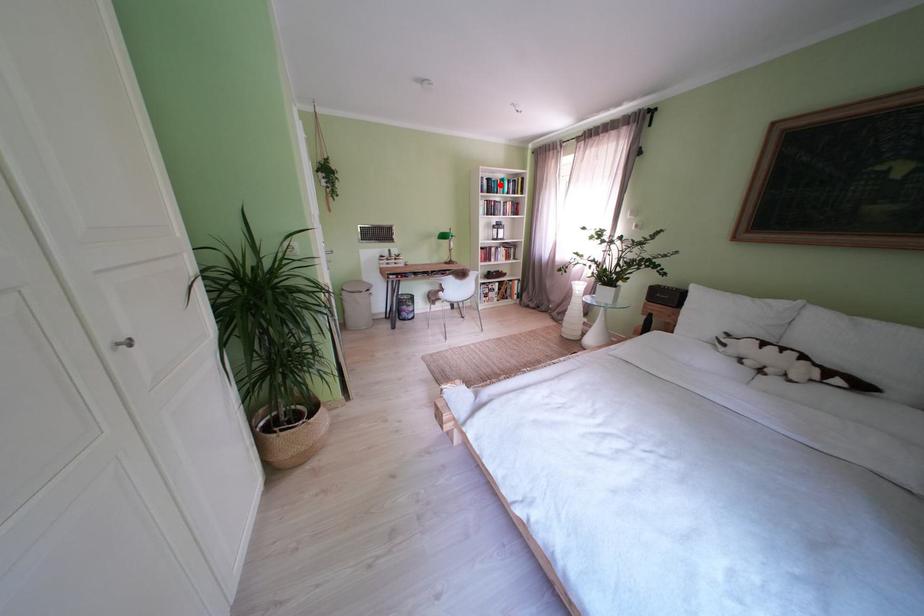
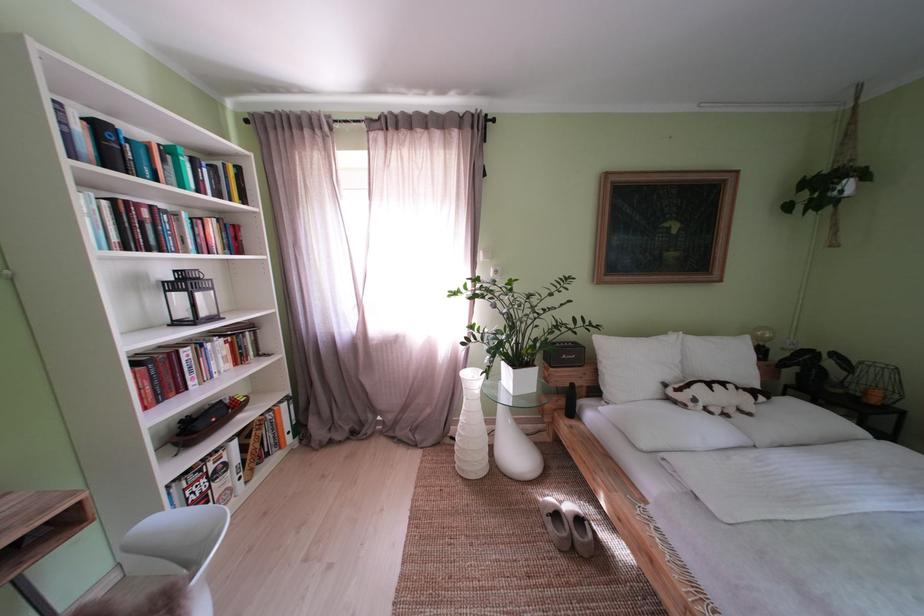
Where in the second image is the point corresponding to the highlighted location from the first image?

(111, 132)